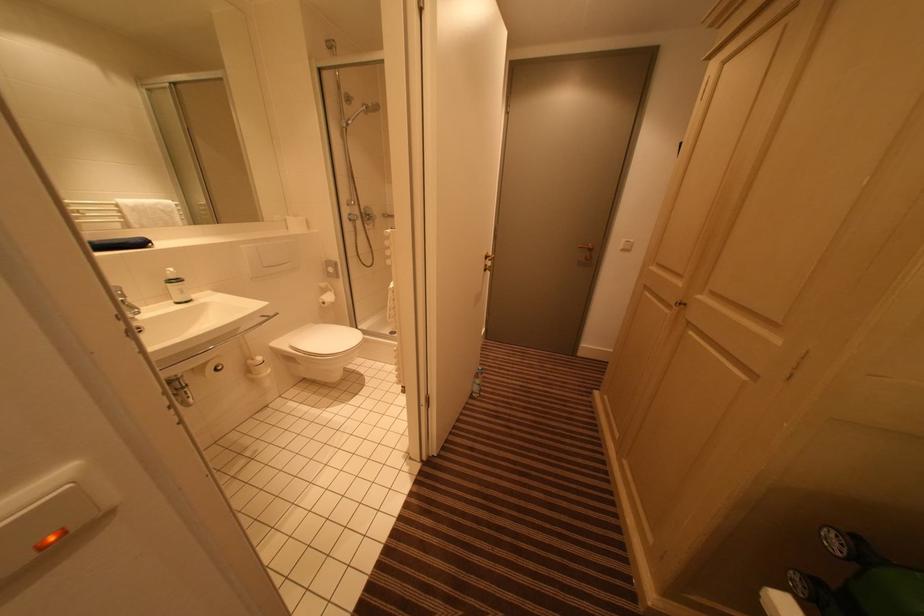
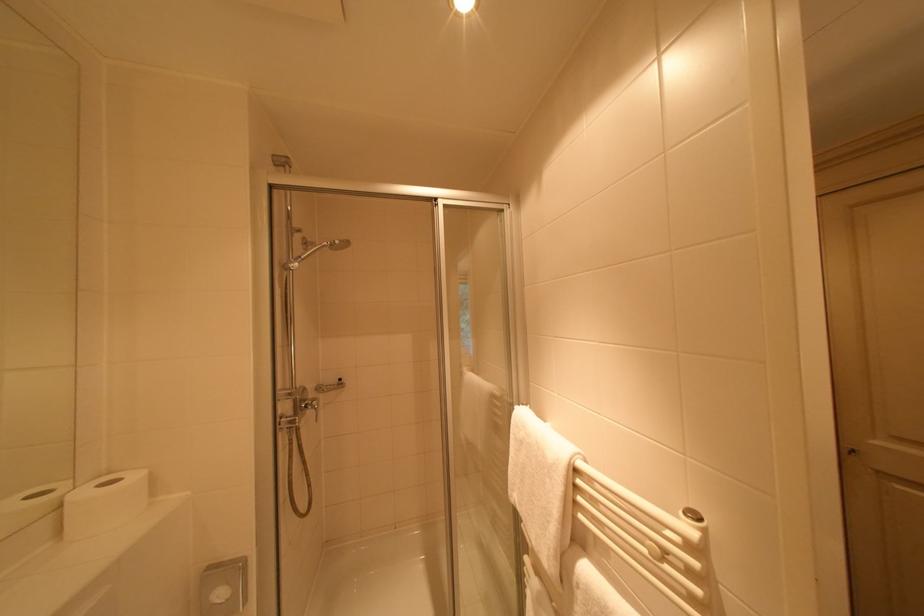
In the second image, find the point that corresponds to point (337, 272) in the first image.

(226, 596)